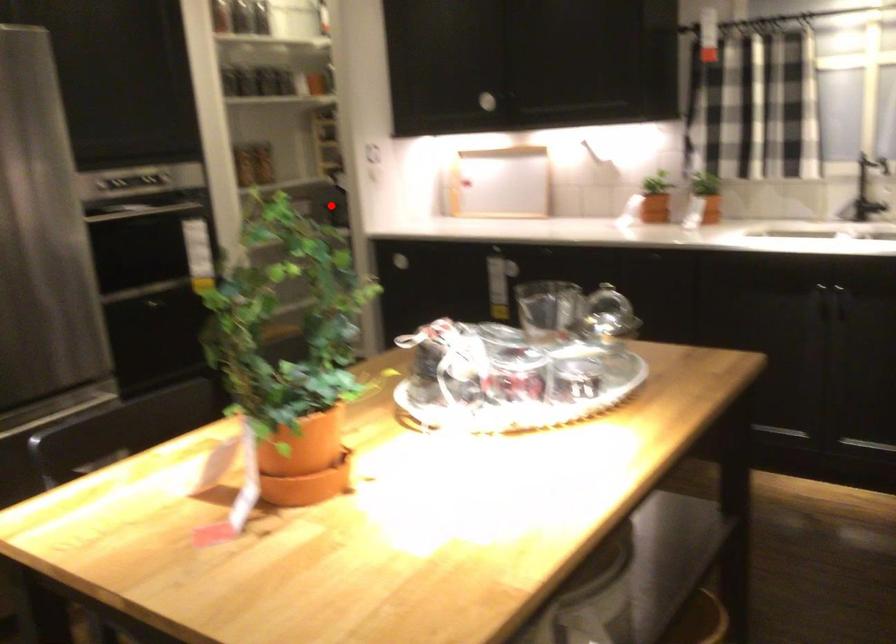
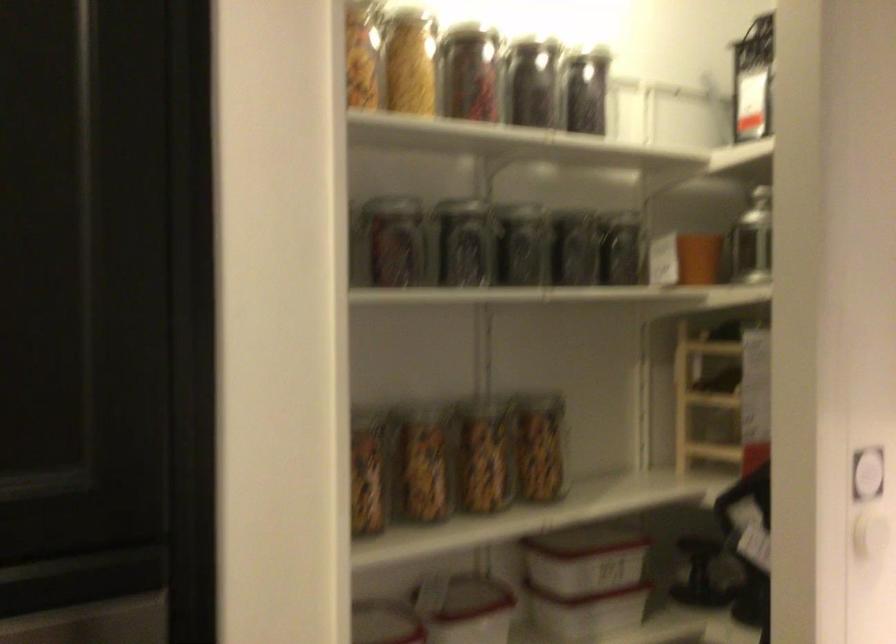
In the second image, find the point that corresponds to the highlighted location in the first image.

(700, 574)